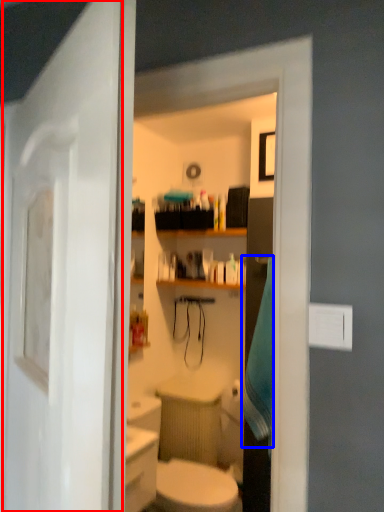
Question: Which object appears closest to the camera in this image, door (highlighted by a red box) or bath towel (highlighted by a blue box)?

Choices:
 (A) door
 (B) bath towel

Answer: (A)